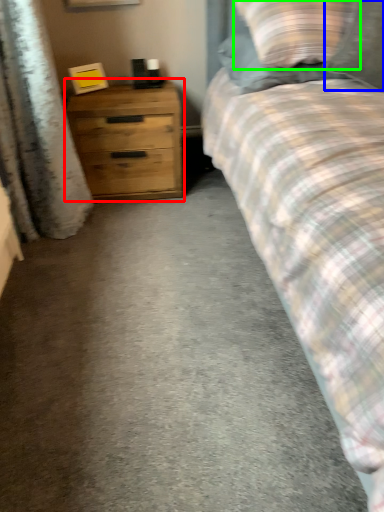
Question: Estimate the real-world distances between objects in this image. Which object is farther from chest of drawers (highlighted by a red box), pillow (highlighted by a blue box) or pillow (highlighted by a green box)?

Choices:
 (A) pillow
 (B) pillow

Answer: (A)